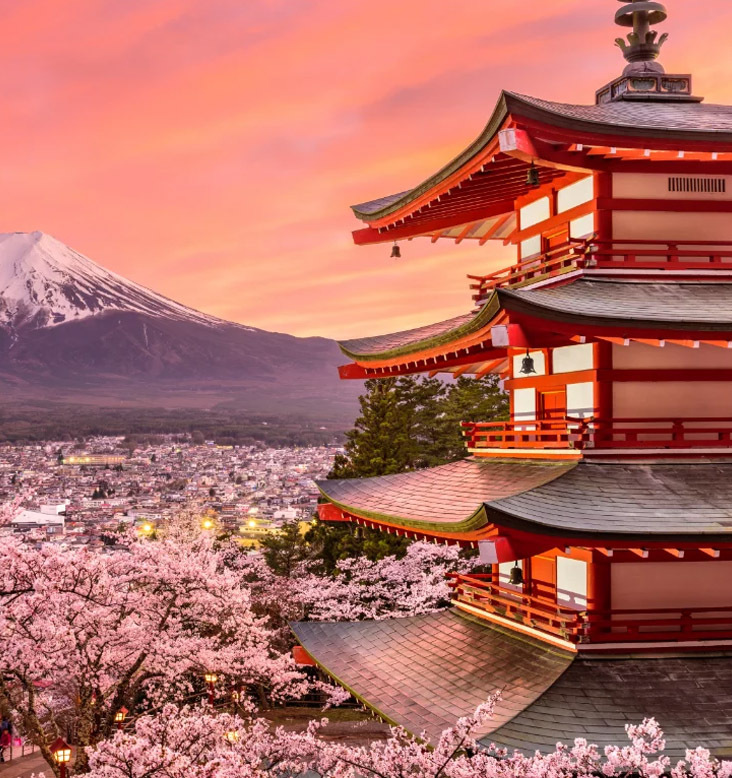
Locate an element on the screen. lamp is located at coordinates (64, 748), (119, 717), (231, 736), (208, 682).